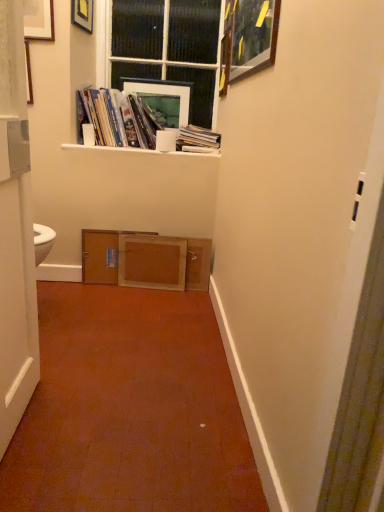
What do you see at coordinates (166, 46) in the screenshot?
I see `black glass window at upper center` at bounding box center [166, 46].

Describe the element at coordinates (166, 140) in the screenshot. This screenshot has width=384, height=512. I see `white matte toilet paper at upper center` at that location.

Locate an element on the screen. This screenshot has height=512, width=384. matte white picture frame at upper center, which is the 1th picture frame from back to front is located at coordinates (162, 99).

Measure the distance between point (160, 96) and camera.

Point (160, 96) and camera are 8.50 feet apart from each other.

At what (x,y) coordinates should I click in order to perform the action: click on white paper stack at upper center, which ranks as the first book in right-to-left order. Please return your answer as a coordinate pair (x, y). The width and height of the screenshot is (384, 512). Looking at the image, I should click on (197, 139).

This screenshot has height=512, width=384. What do you see at coordinates (197, 139) in the screenshot?
I see `white paper stack at upper center, which ranks as the first book in right-to-left order` at bounding box center [197, 139].

Locate an element on the screen. The width and height of the screenshot is (384, 512). black glass window at upper center is located at coordinates (166, 46).

Between wooden drawer at center and matte black picture frame at upper left, the second picture frame when ordered from front to back, which one has smaller width?

With smaller width is matte black picture frame at upper left, the second picture frame when ordered from front to back.

Considering the relative sizes of wooden drawer at center and matte black picture frame at upper left, the 2th picture frame viewed from the back, in the image provided, is wooden drawer at center taller than matte black picture frame at upper left, the 2th picture frame viewed from the back,?

Yes.

Looking at this image, which is more to the right, wooden drawer at center or matte black picture frame at upper left, the second picture frame when ordered from front to back?

Positioned to the right is wooden drawer at center.

Is wooden drawer at center oriented away from matte black picture frame at upper left, which ranks as the 1th picture frame in left-to-right order?

No, wooden drawer at center's orientation is not away from matte black picture frame at upper left, which ranks as the 1th picture frame in left-to-right order.

Is black glass window at upper center next to white matte shelf at upper center?

There is a gap between black glass window at upper center and white matte shelf at upper center.

Is black glass window at upper center bigger or smaller than white matte shelf at upper center?

black glass window at upper center is bigger than white matte shelf at upper center.

Can you tell me how much black glass window at upper center and white matte shelf at upper center differ in facing direction?

The facing directions of black glass window at upper center and white matte shelf at upper center are 0.47 degrees apart.

Measure the distance from black glass window at upper center to white matte shelf at upper center.

24.95 inches.

Is white matte door at left bigger than wooden picture frame at upper right, the 3th picture frame positioned from the left?

Yes, white matte door at left is bigger than wooden picture frame at upper right, the 3th picture frame positioned from the left.

How different are the orientations of white matte door at left and wooden picture frame at upper right, marked as the 1th picture frame in a right-to-left arrangement, in degrees?

The angle between the facing direction of white matte door at left and the facing direction of wooden picture frame at upper right, marked as the 1th picture frame in a right-to-left arrangement, is 179 degrees.

Does point (12, 250) appear closer or farther from the camera than point (232, 77)?

Point (12, 250) is closer to the camera than point (232, 77).

Is white matte door at left to the left of wooden picture frame at upper right, the 3th picture frame positioned from the left, from the viewer's perspective?

Correct, you'll find white matte door at left to the left of wooden picture frame at upper right, the 3th picture frame positioned from the left.

What's the angular difference between black glass window at upper center and matte white picture frame at upper center, the second picture frame in the left-to-right sequence,'s facing directions?

0.316 degrees separate the facing orientations of black glass window at upper center and matte white picture frame at upper center, the second picture frame in the left-to-right sequence.

How far apart are black glass window at upper center and matte white picture frame at upper center, which is the 1th picture frame from back to front?

black glass window at upper center and matte white picture frame at upper center, which is the 1th picture frame from back to front, are 6.55 inches apart from each other.

From a real-world perspective, which object stands above the other?

black glass window at upper center.

Considering the relative sizes of black glass window at upper center and matte white picture frame at upper center, which appears as the second picture frame when viewed from the right, in the image provided, is black glass window at upper center bigger than matte white picture frame at upper center, which appears as the second picture frame when viewed from the right,?

Yes.

The width and height of the screenshot is (384, 512). Find the location of `door in front of the white matte toilet paper at upper center`. door in front of the white matte toilet paper at upper center is located at coordinates (15, 232).

From the image's perspective, is white matte door at left under white matte toilet paper at upper center?

Indeed, from the image's perspective, white matte door at left is shown beneath white matte toilet paper at upper center.

Does white matte door at left turn towards white matte toilet paper at upper center?

No, white matte door at left is not facing towards white matte toilet paper at upper center.

Which object is positioned more to the left, white matte door at left or white matte toilet paper at upper center?

From the viewer's perspective, white matte door at left appears more on the left side.

Could you tell me if wooden cabinet at center is facing matte white picture frame at upper center, the second picture frame in the left-to-right sequence?

No, wooden cabinet at center is not aimed at matte white picture frame at upper center, the second picture frame in the left-to-right sequence.

Is wooden cabinet at center positioned far away from matte white picture frame at upper center, which is the 1th picture frame from back to front?

No, there isn't a large distance between wooden cabinet at center and matte white picture frame at upper center, which is the 1th picture frame from back to front.

From a real-world perspective, does wooden cabinet at center stand above white matte toilet paper at upper center?

No, from a real-world perspective, wooden cabinet at center is not above white matte toilet paper at upper center.

Considering the points (133, 240) and (156, 135), which point is behind, point (133, 240) or point (156, 135)?

Positioned behind is point (133, 240).

Could you tell me if wooden cabinet at center is facing white matte toilet paper at upper center?

No, wooden cabinet at center does not turn towards white matte toilet paper at upper center.

Are wooden cabinet at center and white matte toilet paper at upper center located far from each other?

No, wooden cabinet at center is in close proximity to white matte toilet paper at upper center.

You are a GUI agent. You are given a task and a screenshot of the screen. Output one action in this format:
    pyautogui.click(x=<x>, y=<y>)
    Task: Click on the drawer to the right of matte black picture frame at upper left, positioned as the 3th picture frame in right-to-left order
    This screenshot has width=384, height=512.
    Given the screenshot: What is the action you would take?
    pyautogui.click(x=152, y=263)

The width and height of the screenshot is (384, 512). I want to click on window above the white matte shelf at upper center (from a real-world perspective), so click(166, 46).

Which object lies further to the anchor point white paper stack at upper center, which is the 2th book in left-to-right order, white matte shelf at upper center or matte paper books at upper center, the 2th book when ordered from right to left?

Based on the image, matte paper books at upper center, the 2th book when ordered from right to left, appears to be further to white paper stack at upper center, which is the 2th book in left-to-right order.

Looking at the image, which one is located closer to matte black picture frame at upper left, the 2th picture frame viewed from the back, white matte toilet paper at upper center or white matte door at left?

white matte toilet paper at upper center is positioned closer to the anchor matte black picture frame at upper left, the 2th picture frame viewed from the back.

Consider the image. From the image, which object appears to be farther from white paper stack at upper center, which is the 2th book in left-to-right order, white matte door at left or black glass window at upper center?

white matte door at left is positioned further to the anchor white paper stack at upper center, which is the 2th book in left-to-right order.

Looking at this image, looking at the image, which one is located further to black glass window at upper center, white paper stack at upper center, which is the 2th book in left-to-right order, or matte black picture frame at upper left, positioned as the 3th picture frame in right-to-left order?

Based on the image, white paper stack at upper center, which is the 2th book in left-to-right order, appears to be further to black glass window at upper center.

Which object lies further to the anchor point wooden drawer at center, white matte toilet paper at upper center or white matte door at left?

white matte door at left is further to wooden drawer at center.

Considering their positions, is matte paper books at upper center, the 1th book in the left-to-right sequence, positioned further to white paper stack at upper center, which ranks as the first book in right-to-left order, than matte black picture frame at upper left, the 2th picture frame viewed from the back?

matte black picture frame at upper left, the 2th picture frame viewed from the back.

Estimate the real-world distances between objects in this image. Which object is closer to wooden cabinet at center, matte black picture frame at upper left, positioned as the 3th picture frame in right-to-left order, or white matte toilet paper at upper center?

white matte toilet paper at upper center is closer to wooden cabinet at center.

Which object lies nearer to the anchor point wooden cabinet at center, white paper stack at upper center, which is the 2th book in left-to-right order, or white matte toilet paper at upper center?

white matte toilet paper at upper center lies closer to wooden cabinet at center than the other object.

This screenshot has width=384, height=512. I want to click on window between matte black picture frame at upper left, the 2th picture frame viewed from the back, and white paper stack at upper center, which is the 2th book in left-to-right order, in the up-down direction, so click(166, 46).

The image size is (384, 512). I want to click on book between white matte door at left and white matte toilet paper at upper center in the front-back direction, so click(119, 118).

Find the location of a particular element. Image resolution: width=384 pixels, height=512 pixels. toilet paper between matte black picture frame at upper left, which ranks as the 1th picture frame in left-to-right order, and wooden drawer at center from top to bottom is located at coordinates (166, 140).

Locate an element on the screen. The width and height of the screenshot is (384, 512). window sill between black glass window at upper center and wooden cabinet at center in the up-down direction is located at coordinates (144, 150).